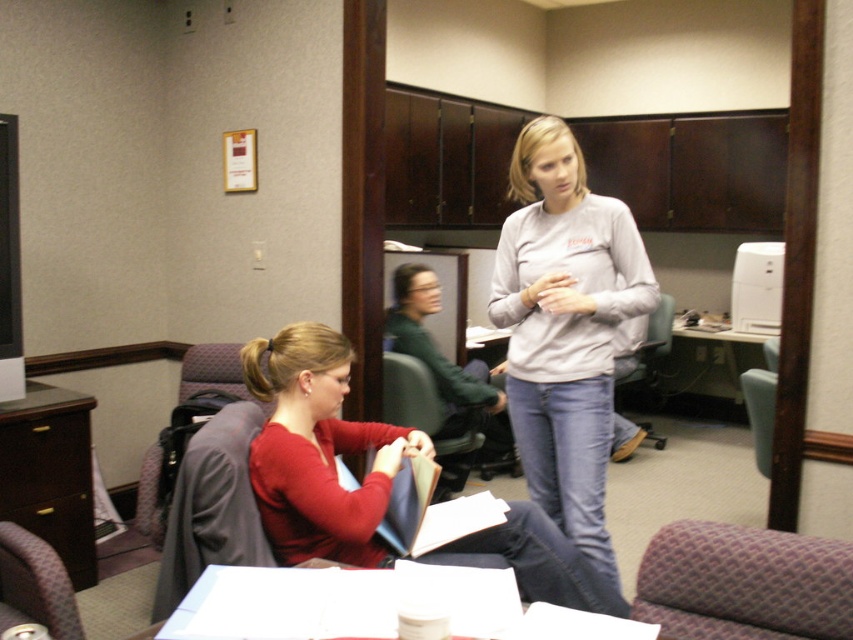
Question: Which object is closer to the camera taking this photo?

Choices:
 (A) white glossy table at center
 (B) matte red sweater at center
 (C) white paper at center
 (D) matte gray sweatshirt at center

Answer: (C)

Question: Is matte gray sweatshirt at center to the right of white paper at center from the viewer's perspective?

Choices:
 (A) yes
 (B) no

Answer: (A)

Question: Is matte gray sweatshirt at center closer to the viewer compared to white paper at center?

Choices:
 (A) no
 (B) yes

Answer: (A)

Question: Which object is the farthest from the white paper at center?

Choices:
 (A) matte gray sweatshirt at center
 (B) white glossy table at center

Answer: (B)

Question: Is matte gray sweatshirt at center to the left of white paper at center from the viewer's perspective?

Choices:
 (A) yes
 (B) no

Answer: (B)

Question: Which point appears farthest from the camera in this image?

Choices:
 (A) coord(514,513)
 (B) coord(706,378)
 (C) coord(520,316)
 (D) coord(601,628)

Answer: (B)